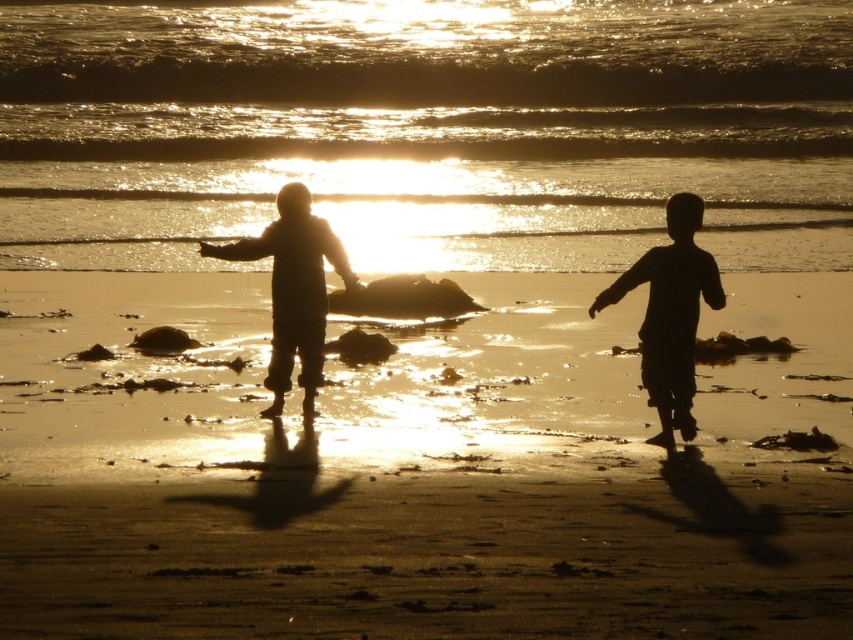
Question: Based on their relative distances, which object is farther from the golden reflective water at center?

Choices:
 (A) silhouette figure at center
 (B) smooth brown surfboard at center

Answer: (A)

Question: Considering the relative positions of smooth sand at center and smooth brown surfboard at center in the image provided, where is smooth sand at center located with respect to smooth brown surfboard at center?

Choices:
 (A) right
 (B) left

Answer: (B)

Question: Can you confirm if silhouette child at right is bigger than silhouette figure at center?

Choices:
 (A) no
 (B) yes

Answer: (B)

Question: Considering the relative positions of silhouette child at right and silhouette figure at center in the image provided, where is silhouette child at right located with respect to silhouette figure at center?

Choices:
 (A) right
 (B) left

Answer: (A)

Question: Which of the following is the farthest from the observer?

Choices:
 (A) smooth brown surfboard at center
 (B) smooth sand at center
 (C) silhouette figure at center
 (D) silhouette child at right

Answer: (A)

Question: Which object appears farthest from the camera in this image?

Choices:
 (A) silhouette child at right
 (B) golden reflective water at center
 (C) smooth sand at center

Answer: (B)